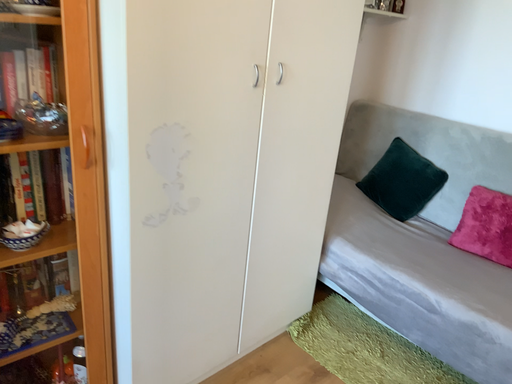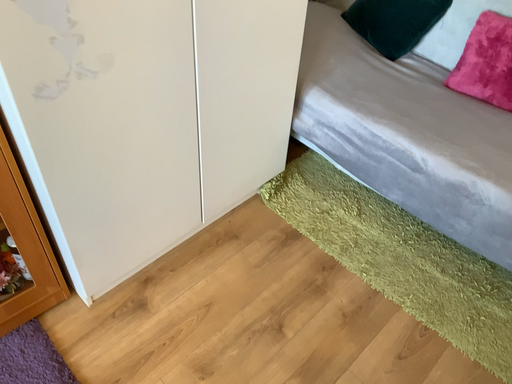
Question: How did the camera likely rotate when shooting the video?

Choices:
 (A) rotated downward
 (B) rotated upward

Answer: (A)